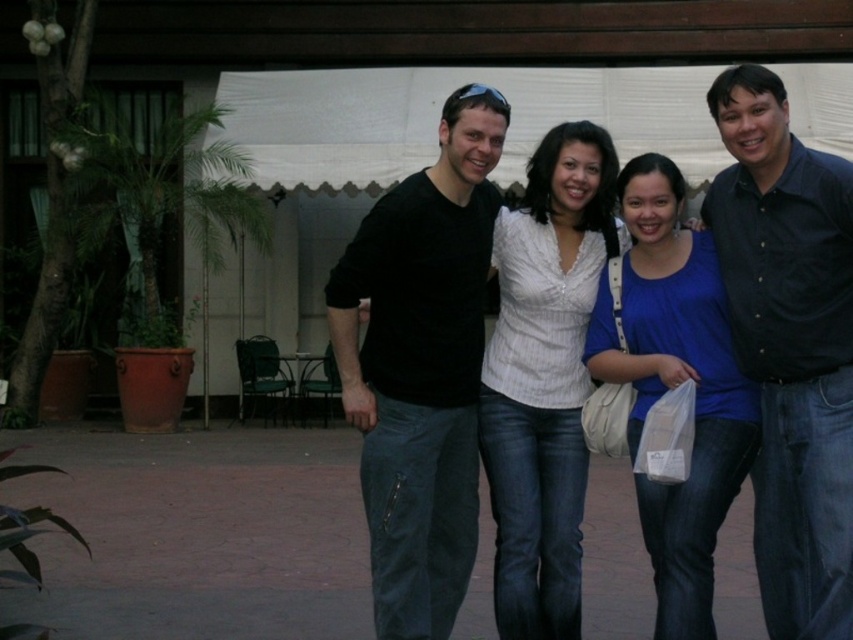
Describe the element at coordinates (544, 378) in the screenshot. I see `white textured blouse at center` at that location.

Which is above, white textured blouse at center or blue cotton shirt at center?

white textured blouse at center

Who is more distant from viewer, (585, 196) or (706, 442)?

Point (585, 196)

Where is `white textured blouse at center`? This screenshot has height=640, width=853. white textured blouse at center is located at coordinates (544, 378).

Describe the element at coordinates (788, 346) in the screenshot. I see `matte black shirt at center` at that location.

Which is below, matte black shirt at center or blue cotton shirt at center?

blue cotton shirt at center is below.

This screenshot has height=640, width=853. Describe the element at coordinates (788, 346) in the screenshot. I see `matte black shirt at center` at that location.

The height and width of the screenshot is (640, 853). Find the location of `matte black shirt at center`. matte black shirt at center is located at coordinates (788, 346).

Between matte black shirt at center and black shirt at center, which one appears on the left side from the viewer's perspective?

matte black shirt at center

Between matte black shirt at center and black shirt at center, which one has less height?

black shirt at center is shorter.

From the picture: Who is more distant from viewer, (805, 224) or (738, 236)?

The point (738, 236) is behind.

Find the location of a particular element. Image resolution: width=853 pixels, height=640 pixels. matte black shirt at center is located at coordinates (788, 346).